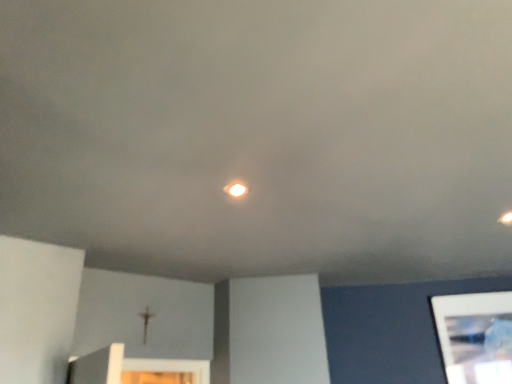
Question: Considering the relative sizes of matte white light at center and white glossy tablet at lower right in the image provided, is matte white light at center smaller than white glossy tablet at lower right?

Choices:
 (A) no
 (B) yes

Answer: (B)

Question: Could you tell me if matte white light at center is facing white glossy tablet at lower right?

Choices:
 (A) no
 (B) yes

Answer: (A)

Question: From a real-world perspective, is matte white light at center physically below white glossy tablet at lower right?

Choices:
 (A) no
 (B) yes

Answer: (A)

Question: Does matte white light at center have a larger size compared to white glossy tablet at lower right?

Choices:
 (A) yes
 (B) no

Answer: (B)

Question: Is matte white light at center shorter than white glossy tablet at lower right?

Choices:
 (A) yes
 (B) no

Answer: (A)

Question: Is white glossy tablet at lower right completely or partially inside matte white light at center?

Choices:
 (A) no
 (B) yes

Answer: (A)

Question: Considering the relative sizes of white glossy tablet at lower right and matte white light at center in the image provided, is white glossy tablet at lower right bigger than matte white light at center?

Choices:
 (A) yes
 (B) no

Answer: (A)

Question: Does white glossy tablet at lower right appear on the left side of matte white light at center?

Choices:
 (A) no
 (B) yes

Answer: (A)

Question: Is white glossy tablet at lower right shorter than matte white light at center?

Choices:
 (A) no
 (B) yes

Answer: (A)

Question: From the image's perspective, is white glossy tablet at lower right under matte white light at center?

Choices:
 (A) no
 (B) yes

Answer: (B)

Question: Is white glossy tablet at lower right at the right side of matte white light at center?

Choices:
 (A) yes
 (B) no

Answer: (A)

Question: From a real-world perspective, is white glossy tablet at lower right on top of matte white light at center?

Choices:
 (A) no
 (B) yes

Answer: (A)

Question: In terms of size, does matte white light at center appear bigger or smaller than white glossy tablet at lower right?

Choices:
 (A) big
 (B) small

Answer: (B)